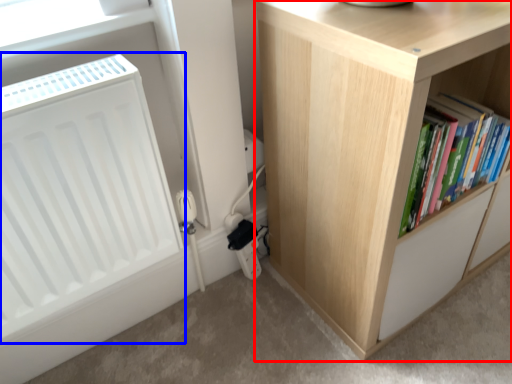
Question: Among these objects, which one is nearest to the camera, cupboard (highlighted by a red box) or radiator (highlighted by a blue box)?

Choices:
 (A) cupboard
 (B) radiator

Answer: (B)